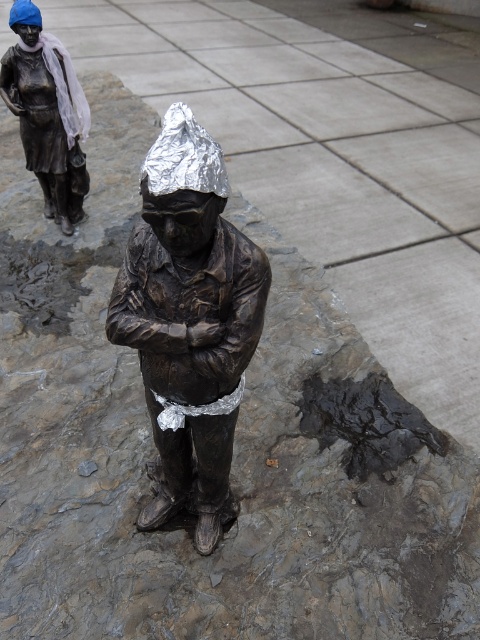
Measure the distance between bronze/statue at center and bronze statue at upper left.

2.07 meters

Does bronze/statue at center appear under bronze statue at upper left?

Indeed, bronze/statue at center is positioned under bronze statue at upper left.

Locate an element on the screen. The height and width of the screenshot is (640, 480). bronze/statue at center is located at coordinates (189, 317).